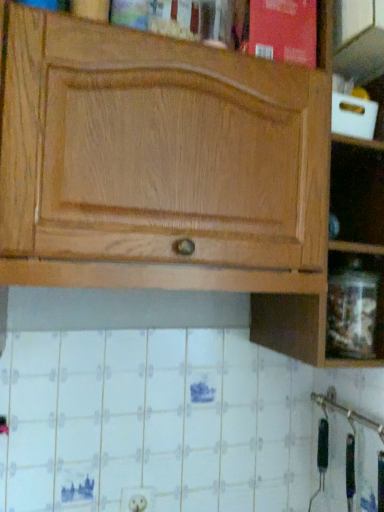
Question: Is there a large distance between natural wood cabinet at upper center and white plastic electric outlet at lower center?

Choices:
 (A) yes
 (B) no

Answer: (B)

Question: Is natural wood cabinet at upper center beside white plastic electric outlet at lower center?

Choices:
 (A) yes
 (B) no

Answer: (B)

Question: Is natural wood cabinet at upper center smaller than white plastic electric outlet at lower center?

Choices:
 (A) no
 (B) yes

Answer: (A)

Question: Is natural wood cabinet at upper center at the right side of white plastic electric outlet at lower center?

Choices:
 (A) yes
 (B) no

Answer: (A)

Question: Is natural wood cabinet at upper center not within white plastic electric outlet at lower center?

Choices:
 (A) no
 (B) yes

Answer: (B)

Question: Looking at the image, does white plastic electric outlet at lower center seem bigger or smaller compared to transparent glass jar at lower right?

Choices:
 (A) big
 (B) small

Answer: (B)

Question: From a real-world perspective, is white plastic electric outlet at lower center above or below transparent glass jar at lower right?

Choices:
 (A) below
 (B) above

Answer: (A)

Question: Is white plastic electric outlet at lower center spatially inside transparent glass jar at lower right, or outside of it?

Choices:
 (A) inside
 (B) outside

Answer: (B)

Question: Is white plastic electric outlet at lower center to the left or to the right of transparent glass jar at lower right in the image?

Choices:
 (A) right
 (B) left

Answer: (B)

Question: Looking at their shapes, would you say natural wood cabinet at upper center is wider or thinner than white plastic electric outlet at lower center?

Choices:
 (A) wide
 (B) thin

Answer: (A)

Question: From the image's perspective, relative to white plastic electric outlet at lower center, is natural wood cabinet at upper center above or below?

Choices:
 (A) above
 (B) below

Answer: (A)

Question: Would you say natural wood cabinet at upper center is to the left or to the right of white plastic electric outlet at lower center in the picture?

Choices:
 (A) right
 (B) left

Answer: (A)

Question: Is natural wood cabinet at upper center spatially inside white plastic electric outlet at lower center, or outside of it?

Choices:
 (A) outside
 (B) inside

Answer: (A)

Question: Considering the positions of natural wood cabinet at upper center and transparent glass jar at lower right in the image, is natural wood cabinet at upper center taller or shorter than transparent glass jar at lower right?

Choices:
 (A) short
 (B) tall

Answer: (B)

Question: From a real-world perspective, is natural wood cabinet at upper center physically located above or below transparent glass jar at lower right?

Choices:
 (A) above
 (B) below

Answer: (A)